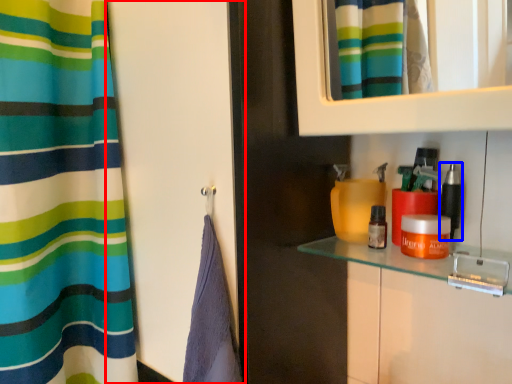
Question: Which point is further to the camera, screen door (highlighted by a red box) or cosmetic (highlighted by a blue box)?

Choices:
 (A) screen door
 (B) cosmetic

Answer: (B)